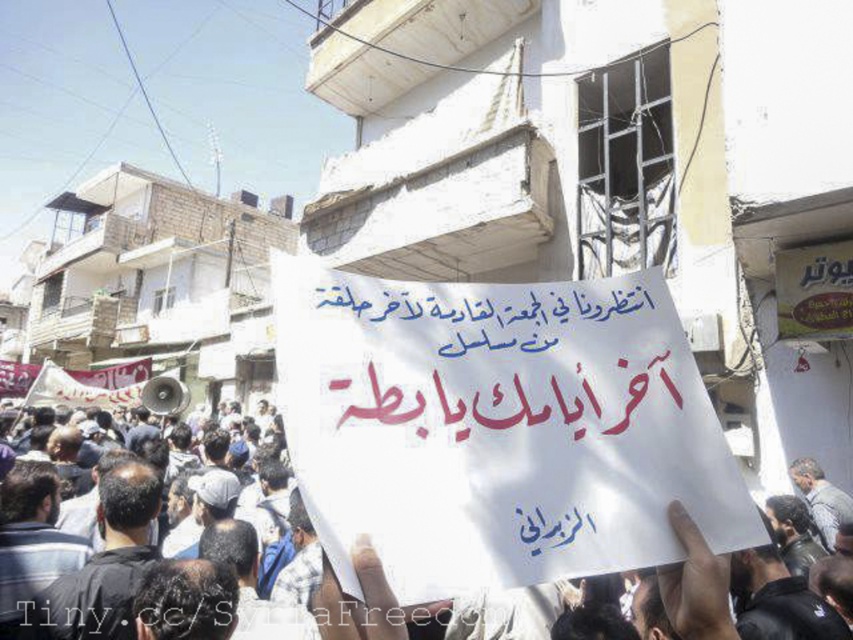
Consider the image. You are a photographer standing in the protest scene and want to take a photo that includes both the point at point (339, 604) and the point at point (154, 396). Which point should you focus on first to ensure both are in focus?

You should focus on point (339, 604) first because it is closer to the viewer than point (154, 396). By focusing on the closer point, the farther point will also be in focus due to the depth of field.